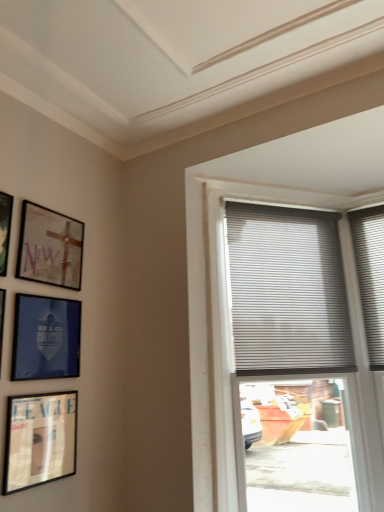
Question: Does matte black picture frame at left, which is the 3th picture frame from top to bottom, turn towards gray pleated blinds at upper right?

Choices:
 (A) yes
 (B) no

Answer: (B)

Question: Is matte black picture frame at left, which is the 3th picture frame from top to bottom, further to camera compared to gray pleated blinds at upper right?

Choices:
 (A) yes
 (B) no

Answer: (B)

Question: Considering the relative sizes of matte black picture frame at left, which is the 3th picture frame from top to bottom, and gray pleated blinds at upper right in the image provided, is matte black picture frame at left, which is the 3th picture frame from top to bottom, shorter than gray pleated blinds at upper right?

Choices:
 (A) no
 (B) yes

Answer: (B)

Question: Considering the relative sizes of matte black picture frame at left, which is the 3th picture frame from top to bottom, and gray pleated blinds at upper right in the image provided, is matte black picture frame at left, which is the 3th picture frame from top to bottom, thinner than gray pleated blinds at upper right?

Choices:
 (A) no
 (B) yes

Answer: (B)

Question: Does matte black picture frame at left, which is the 3th picture frame from top to bottom, have a greater width compared to gray pleated blinds at upper right?

Choices:
 (A) yes
 (B) no

Answer: (B)

Question: Choose the correct answer: Is gray pleated blinds at upper right inside matte black picture frame at left, which is the 3th picture frame from top to bottom, or outside it?

Choices:
 (A) outside
 (B) inside

Answer: (A)

Question: Considering the positions of gray pleated blinds at upper right and matte black picture frame at left, which appears as the 3th picture frame when ordered from the bottom, in the image, is gray pleated blinds at upper right wider or thinner than matte black picture frame at left, which appears as the 3th picture frame when ordered from the bottom,?

Choices:
 (A) wide
 (B) thin

Answer: (A)

Question: From the image's perspective, is gray pleated blinds at upper right located above or below matte black picture frame at left, which is the 3th picture frame from top to bottom?

Choices:
 (A) above
 (B) below

Answer: (A)

Question: From a real-world perspective, is gray pleated blinds at upper right above or below matte black picture frame at left, which appears as the 3th picture frame when ordered from the bottom?

Choices:
 (A) above
 (B) below

Answer: (A)

Question: Is gray pleated blinds at upper right wider or thinner than matte glass picture frame at upper left, the fourth picture frame when ordered from bottom to top?

Choices:
 (A) wide
 (B) thin

Answer: (A)

Question: Is gray pleated blinds at upper right taller or shorter than matte glass picture frame at upper left, the fourth picture frame when ordered from bottom to top?

Choices:
 (A) tall
 (B) short

Answer: (A)

Question: Is point (306, 258) closer or farther from the camera than point (36, 233)?

Choices:
 (A) closer
 (B) farther

Answer: (B)

Question: Considering the positions of gray pleated blinds at upper right and matte glass picture frame at upper left, which is the 2th picture frame in top-to-bottom order, in the image, is gray pleated blinds at upper right bigger or smaller than matte glass picture frame at upper left, which is the 2th picture frame in top-to-bottom order,?

Choices:
 (A) big
 (B) small

Answer: (A)

Question: In terms of height, does matte black picture frame at lower left, positioned as the fifth picture frame in top-to-bottom order, look taller or shorter compared to matte black picture frame at upper left, which appears as the fifth picture frame when ordered from the bottom?

Choices:
 (A) short
 (B) tall

Answer: (A)

Question: From the image's perspective, relative to matte black picture frame at upper left, the 1th picture frame from the top, is matte black picture frame at lower left, positioned as the fifth picture frame in top-to-bottom order, above or below?

Choices:
 (A) below
 (B) above

Answer: (A)